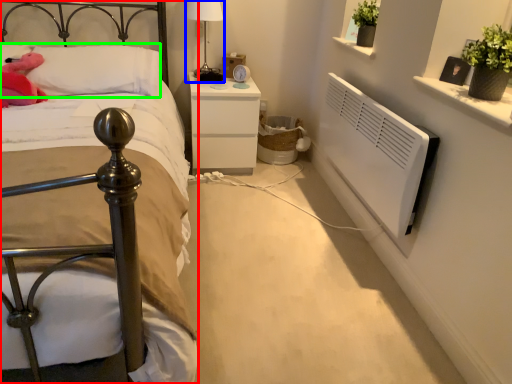
Question: Which object is positioned farthest from bed (highlighted by a red box)? Select from bedside lamp (highlighted by a blue box) and pillow (highlighted by a green box).

Choices:
 (A) bedside lamp
 (B) pillow

Answer: (A)